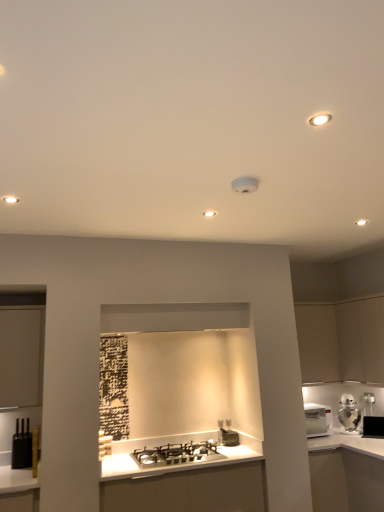
Question: Considering their positions, is white glossy countertop at right located in front of or behind black glossy microwave at upper right, the third appliance in the front-to-back sequence?

Choices:
 (A) behind
 (B) front

Answer: (B)

Question: Based on their positions, is white glossy countertop at right located to the left or right of black glossy microwave at upper right, marked as the first appliance in a right-to-left arrangement?

Choices:
 (A) left
 (B) right

Answer: (A)

Question: Which is farther from the metallic silver toaster at lower center, which is the 2th appliance from back to front?

Choices:
 (A) silver metallic ice bucket at right
 (B) white glossy microwave at right
 (C) white matte cabinet at right, the second cabinetry in the left-to-right sequence
 (D) white glossy countertop at right
 (E) white plastic electric outlet at upper right

Answer: (C)

Question: Estimate the real-world distances between objects in this image. Which object is closer to the white plastic electric outlet at upper right?

Choices:
 (A) silver metallic ice bucket at right
 (B) white glossy microwave at right
 (C) black matte toaster at lower left, the first appliance in the front-to-back sequence
 (D) metallic silver toaster at lower center, which is counted as the second appliance, starting from the right
 (E) shiny silver gas stove at center

Answer: (A)